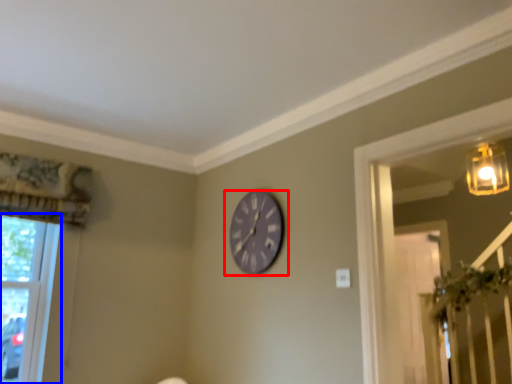
Question: Which of the following is the closest to the observer, wall clock (highlighted by a red box) or window (highlighted by a blue box)?

Choices:
 (A) wall clock
 (B) window

Answer: (B)